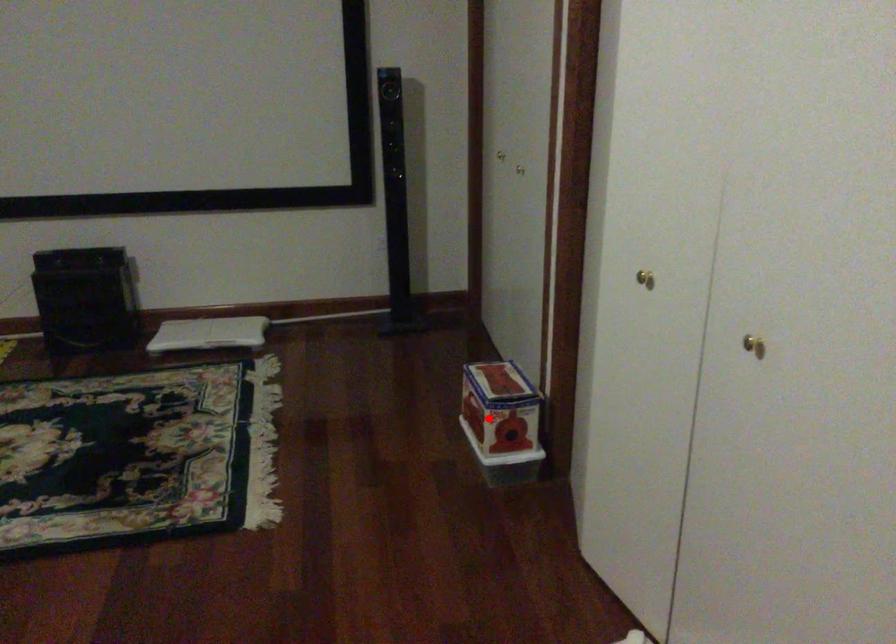
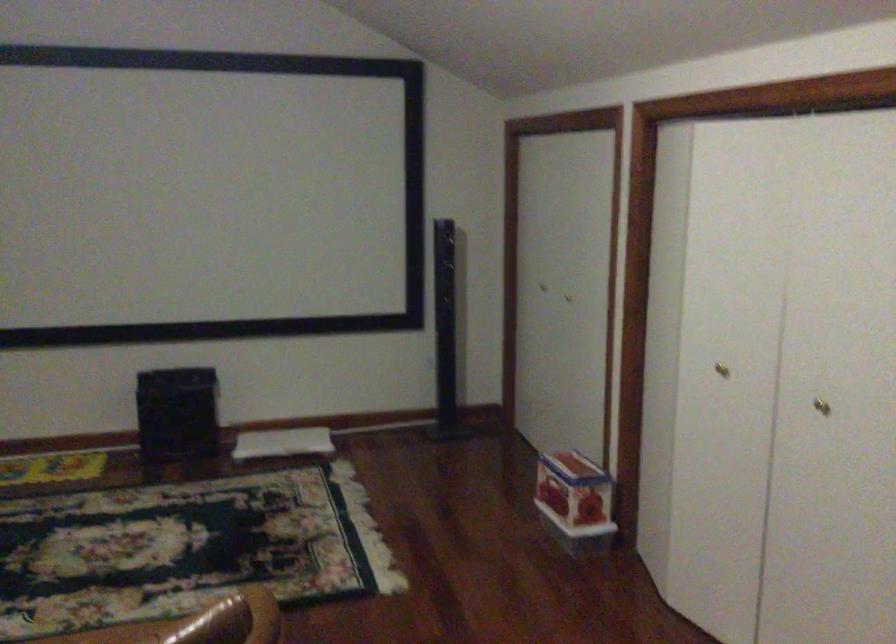
Where in the second image is the point corresponding to the highlighted location from the first image?

(574, 494)